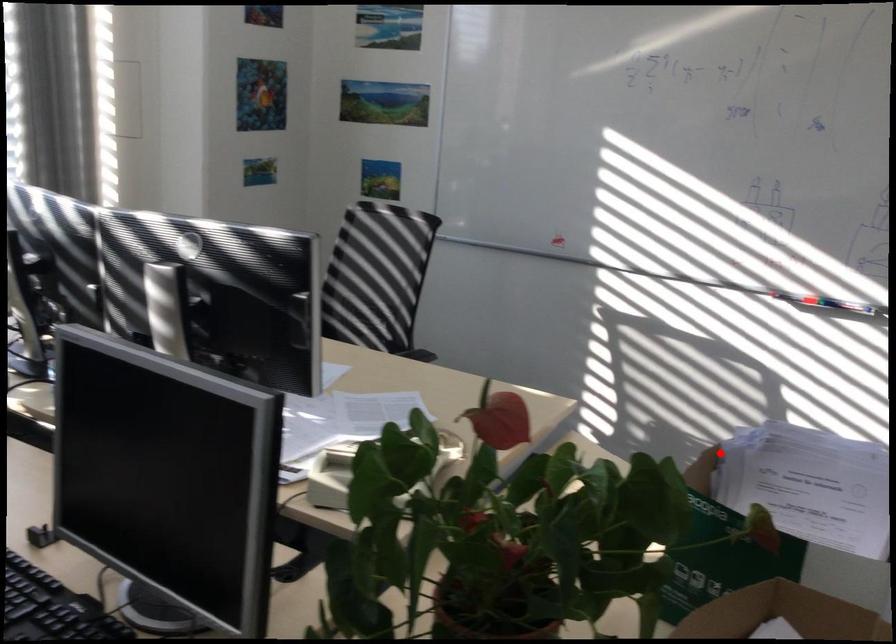
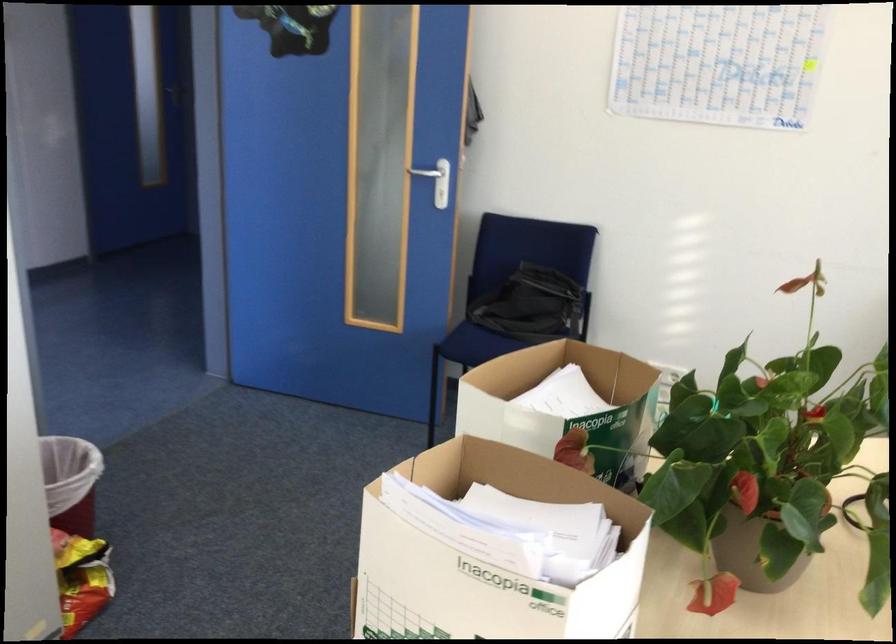
Question: I am providing you with two images of the same scene from different viewpoints. Given a red point in image1, look at the same physical point in image2. Is it:

Choices:
 (A) Closer to the viewpoint
 (B) Farther from the viewpoint

Answer: (A)